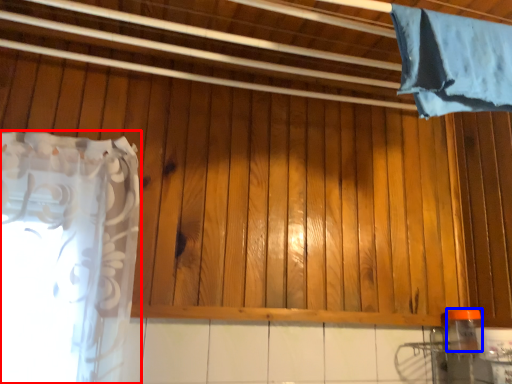
Question: Among these objects, which one is nearest to the camera, curtain (highlighted by a red box) or bottle (highlighted by a blue box)?

Choices:
 (A) curtain
 (B) bottle

Answer: (A)